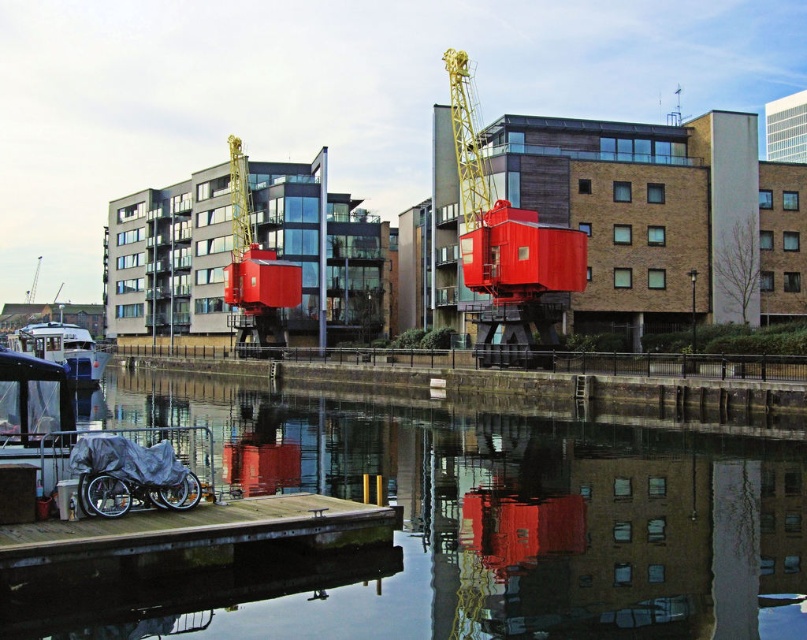
Does wooden dock at lower left have a larger size compared to white glossy boat at lower left?

No, wooden dock at lower left is not bigger than white glossy boat at lower left.

Is point (42, 541) positioned in front of point (92, 376)?

Yes, point (42, 541) is closer to viewer.

Where is `wooden dock at lower left`? The height and width of the screenshot is (640, 807). wooden dock at lower left is located at coordinates (186, 529).

Does smooth concrete dock at lower left have a smaller size compared to wooden dock at lower left?

Actually, smooth concrete dock at lower left might be larger than wooden dock at lower left.

Can you confirm if smooth concrete dock at lower left is bigger than wooden dock at lower left?

Correct, smooth concrete dock at lower left is larger in size than wooden dock at lower left.

This screenshot has height=640, width=807. Describe the element at coordinates (454, 529) in the screenshot. I see `smooth concrete dock at lower left` at that location.

Where is `smooth concrete dock at lower left`? Image resolution: width=807 pixels, height=640 pixels. smooth concrete dock at lower left is located at coordinates (454, 529).

From the picture: Between smooth concrete dock at lower left and white glossy boat at lower left, which one is positioned lower?

smooth concrete dock at lower left is lower down.

Does smooth concrete dock at lower left appear under white glossy boat at lower left?

Correct, smooth concrete dock at lower left is located below white glossy boat at lower left.

Which is in front, point (500, 547) or point (98, 374)?

Point (500, 547) is in front.

The image size is (807, 640). Identify the location of smooth concrete dock at lower left. (454, 529).